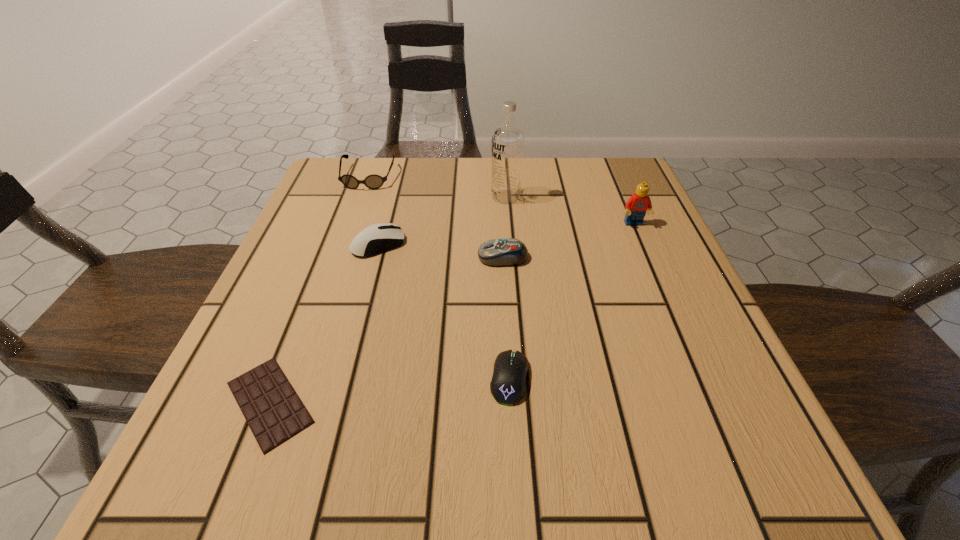
The height and width of the screenshot is (540, 960). In order to click on vacant space that is in between the shortest object and the sunglasses in this screenshot , I will do click(319, 290).

I want to click on empty space that is in between the leftmost computer equipment and the third farthest object, so click(506, 234).

Identify the location of empty space that is in between the rightmost object and the shortest object. (452, 313).

The image size is (960, 540). I want to click on vacant space that's between the Lego and the shortest object, so click(x=452, y=313).

This screenshot has height=540, width=960. In order to click on unoccupied area between the tallest object and the fifth nearest object in this screenshot , I will do `click(569, 211)`.

Find the location of `object identified as the fourth closest to the sunglasses`. object identified as the fourth closest to the sunglasses is located at coordinates (273, 410).

Select which object appears as the fourth closest to the shortest computer equipment. Please provide its 2D coordinates. Your answer should be formatted as a tuple, i.e. [(x, y)], where the tuple contains the x and y coordinates of a point satisfying the conditions above.

[(636, 206)]

This screenshot has width=960, height=540. I want to click on computer equipment identified as the second closest to the second shortest object, so click(380, 237).

Choose which computer equipment is the second nearest neighbor to the vodka. Please provide its 2D coordinates. Your answer should be formatted as a tuple, i.e. [(x, y)], where the tuple contains the x and y coordinates of a point satisfying the conditions above.

[(380, 237)]

Find the location of a particular element. This screenshot has height=540, width=960. free space that satisfies the following two spatial constraints: 1. on the back side of the shortest object; 2. on the right side of the leftmost computer equipment is located at coordinates (331, 244).